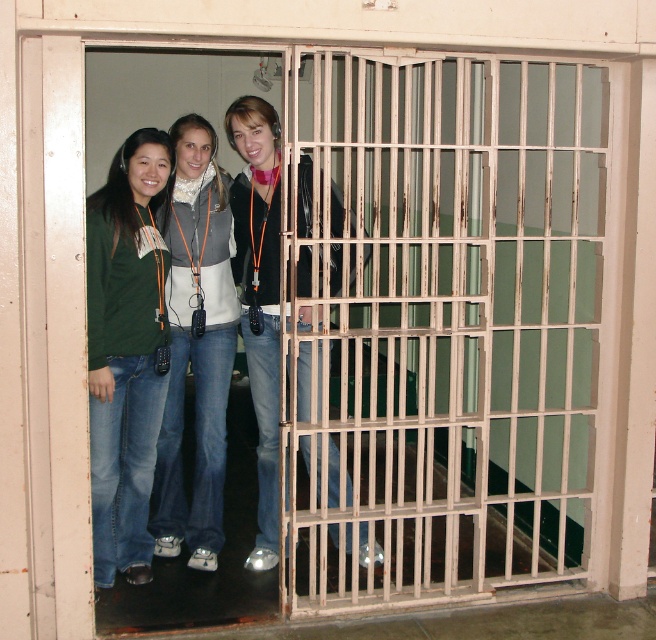
Question: Is rusty metal bars at center below matte black jacket at center?

Choices:
 (A) no
 (B) yes

Answer: (A)

Question: Does matte green shirt at center appear on the right side of matte black jacket at center?

Choices:
 (A) no
 (B) yes

Answer: (A)

Question: Does rusty metal bars at center appear on the left side of matte black jacket at center?

Choices:
 (A) yes
 (B) no

Answer: (B)

Question: Which point appears farthest from the camera in this image?

Choices:
 (A) (276, 516)
 (B) (154, 451)

Answer: (A)

Question: Which is nearer to the matte green shirt at center?

Choices:
 (A) matte black jacket at center
 (B) denim jeans at center

Answer: (B)

Question: Which object appears closest to the camera in this image?

Choices:
 (A) denim jeans at center
 (B) matte black jacket at center
 (C) matte green shirt at center

Answer: (B)